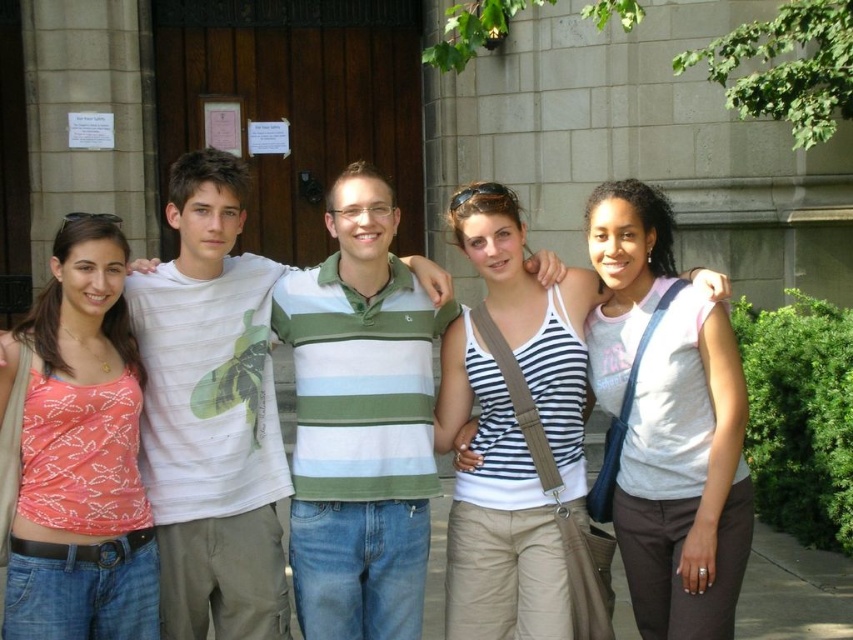
Question: Which object is farther from the camera taking this photo?

Choices:
 (A) white cotton t-shirt at center
 (B) white cotton tank top at center
 (C) striped cotton tank top at center
 (D) matte coral tank top at left

Answer: (A)

Question: Among these points, which one is nearest to the camera?

Choices:
 (A) (486, 442)
 (B) (247, 173)

Answer: (A)

Question: Does striped cotton tank top at center have a smaller size compared to matte coral tank top at left?

Choices:
 (A) no
 (B) yes

Answer: (A)

Question: Can you confirm if white cotton tank top at center is wider than matte coral tank top at left?

Choices:
 (A) no
 (B) yes

Answer: (B)

Question: Can you confirm if striped cotton tank top at center is wider than white cotton tank top at center?

Choices:
 (A) no
 (B) yes

Answer: (B)

Question: Which object is farther from the camera taking this photo?

Choices:
 (A) matte coral tank top at left
 (B) white cotton t-shirt at center
 (C) white cotton tank top at center

Answer: (B)